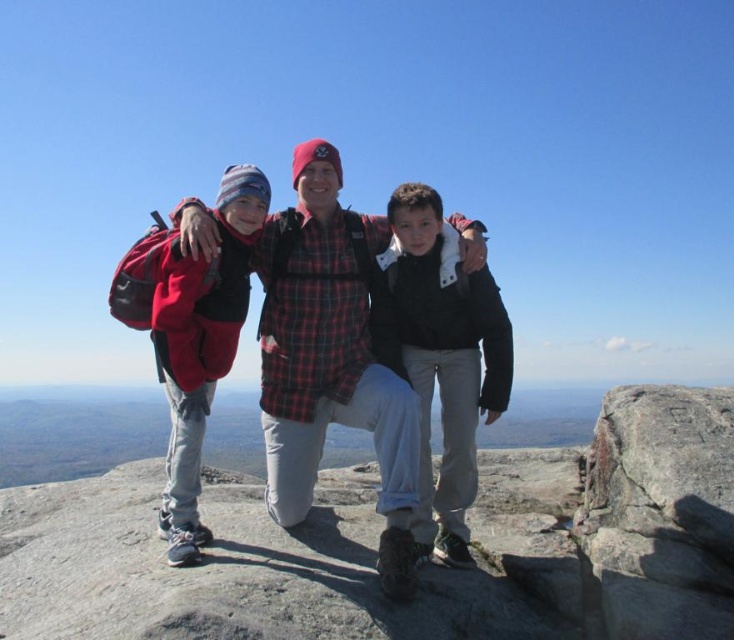
You are planning to place a small potted plant between the gray granite rock at center and the black matte jacket at center. Considering their sizes, which object should the plant be closer to?

The gray granite rock at center is larger than the black matte jacket at center, so the plant should be placed closer to the black matte jacket at center to maintain balance.

You are a geologist examining a rock sample from the coordinates point (374, 544) in the image. What type of rock is present at this location?

The point (374, 544) indicates gray granite rock at center, so the rock sample from this location is gray granite rock.

You are a photographer who wants to capture a photo of the gray granite rock at center and the plaid flannel shirt at center. From the perspective of the camera, which object is positioned to the right?

The gray granite rock at center is to the right of the plaid flannel shirt at center, so from the camera perspective, the gray granite rock at center is positioned to the right.